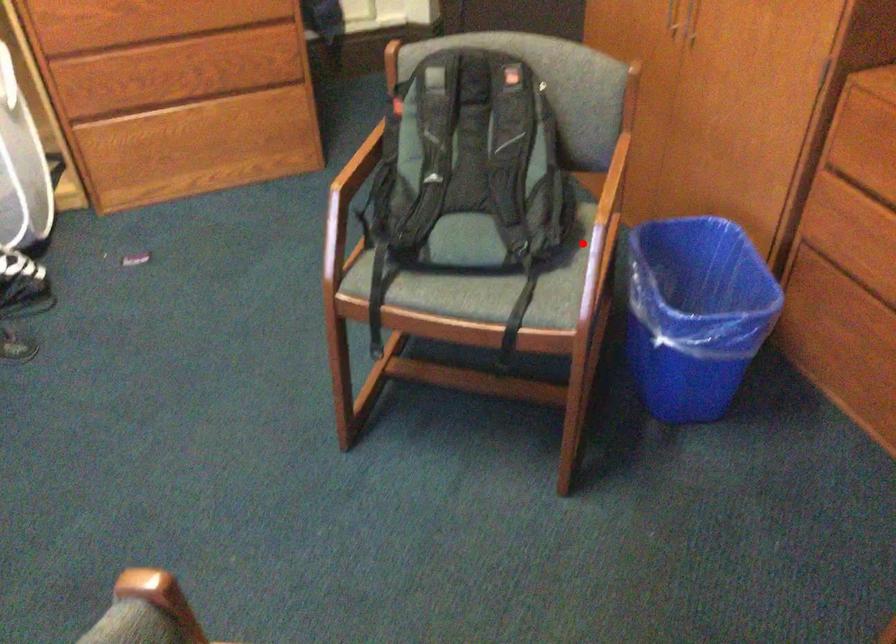
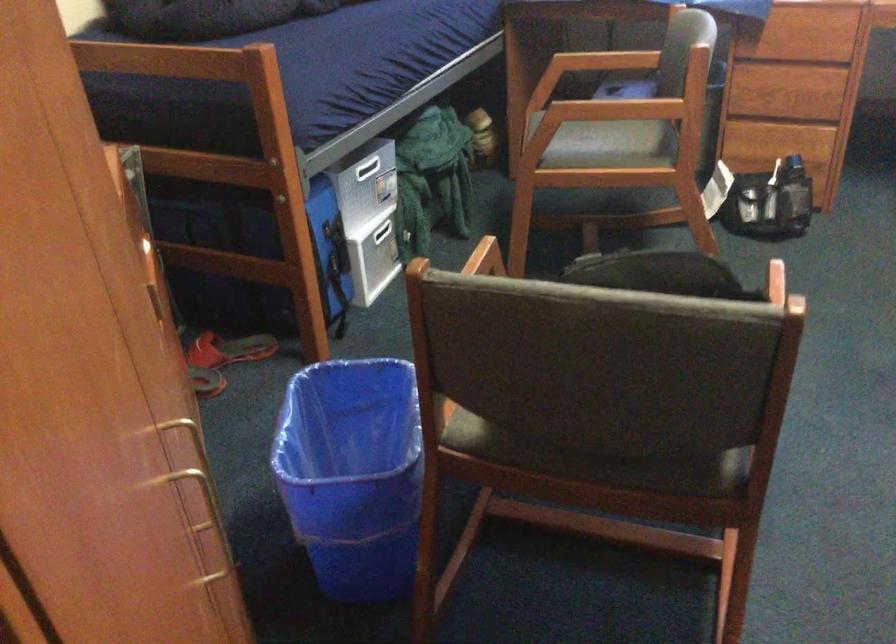
Question: I am providing you with two images of the same scene from different viewpoints. A red point is shown in image1. For the corresponding object point in image2, is it positioned nearer or farther from the camera?

Choices:
 (A) Nearer
 (B) Farther

Answer: (A)